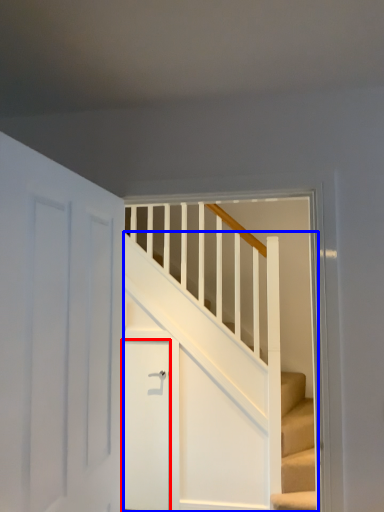
Question: Among these objects, which one is nearest to the camera, door (highlighted by a red box) or stairs (highlighted by a blue box)?

Choices:
 (A) door
 (B) stairs

Answer: (B)